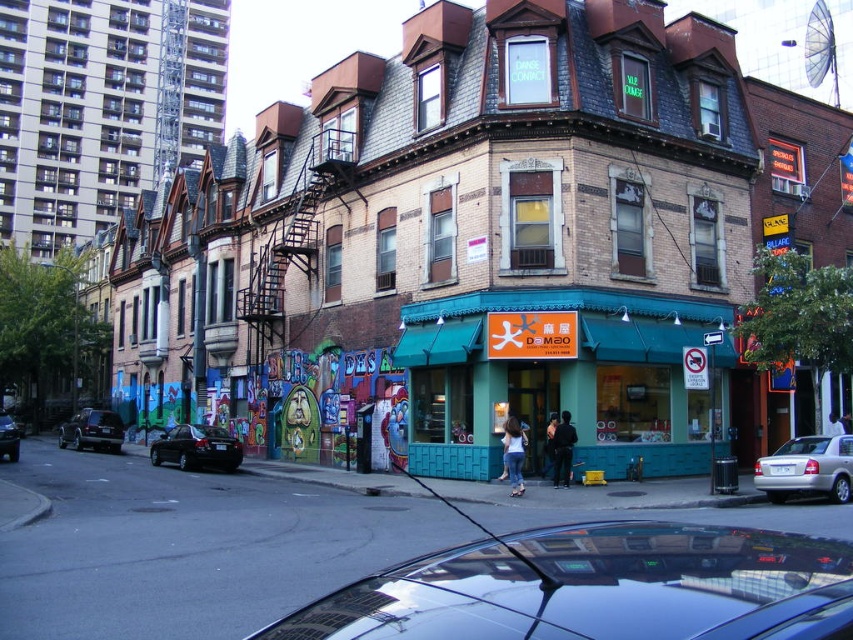
From the picture: You are a customer entering the store with the orange sign. You see a denim jeans at center and a black leather jacket at center. Which item is closer to the floor?

The denim jeans at center is located below the black leather jacket at center, so it is closer to the floor.

You are standing on the street in front of the teal storefront and see both the denim jeans at center and the black leather jacket at center. Which item is closer to you?

The denim jeans at center is closer to the viewer than the black leather jacket at center.